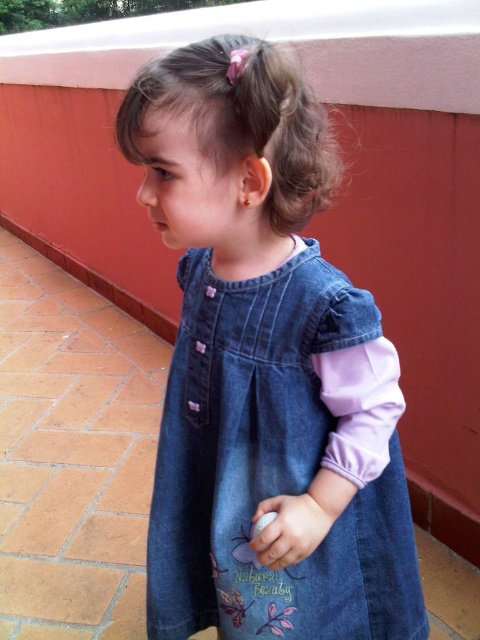
Can you confirm if denim dress at center is wider than white matte ball at center?

Indeed, denim dress at center has a greater width compared to white matte ball at center.

Where is `denim dress at center`? This screenshot has height=640, width=480. denim dress at center is located at coordinates (264, 364).

Who is more distant from viewer, (310, 445) or (297, 554)?

Positioned behind is point (310, 445).

Locate an element on the screen. Image resolution: width=480 pixels, height=640 pixels. denim dress at center is located at coordinates (264, 364).

Which of these two, curly blonde hair at upper center or white matte ball at center, stands shorter?

With less height is white matte ball at center.

Where is `curly blonde hair at upper center`? This screenshot has height=640, width=480. curly blonde hair at upper center is located at coordinates (298, 156).

Can you confirm if denim dress at center is positioned to the right of curly blonde hair at upper center?

No, denim dress at center is not to the right of curly blonde hair at upper center.

Find the location of `denim dress at center`. denim dress at center is located at coordinates (264, 364).